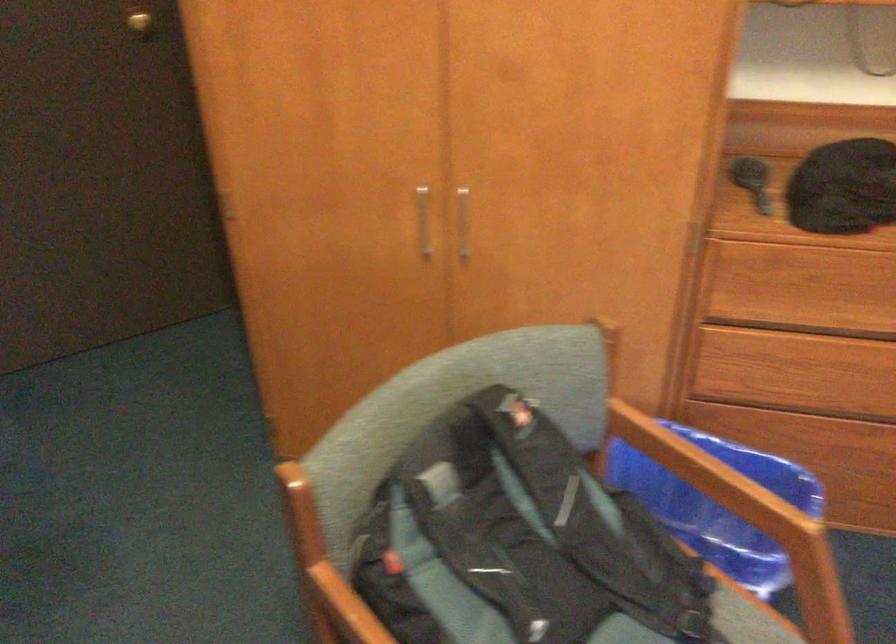
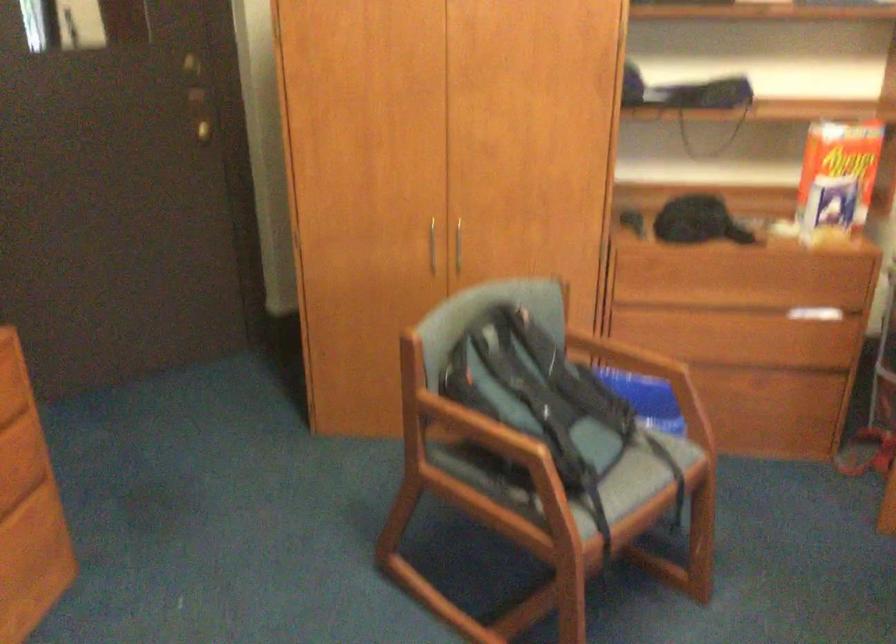
Question: Based on the continuous images, in which direction is the camera rotating? Reply with the corresponding letter.

Choices:
 (A) Left
 (B) Right
 (C) Up
 (D) Down

Answer: (C)